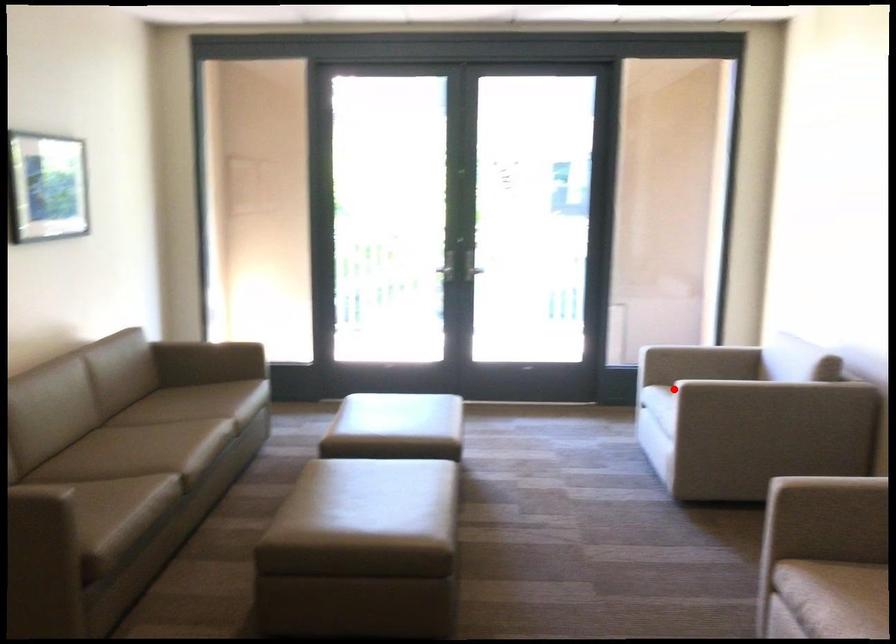
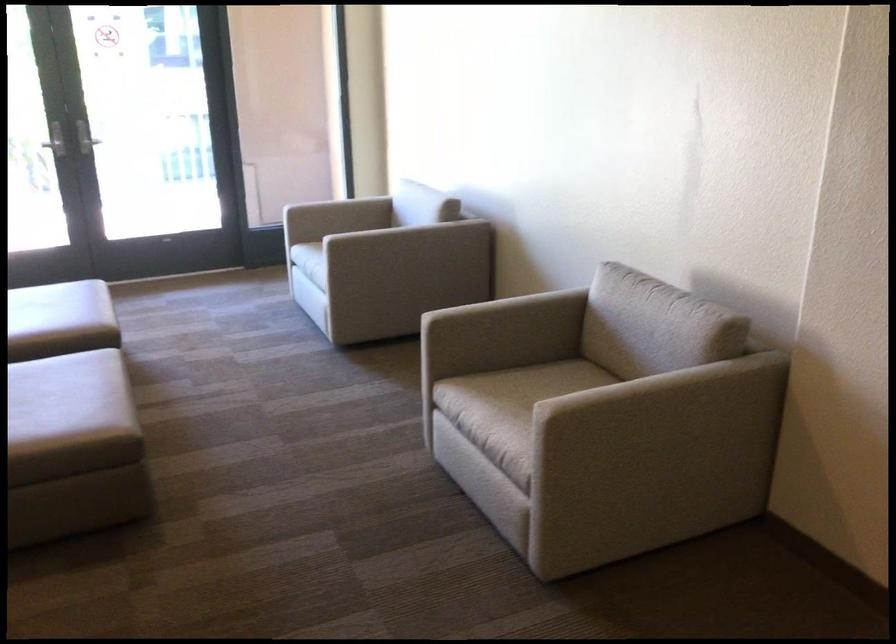
In the second image, find the point that corresponds to the highlighted location in the first image.

(316, 240)